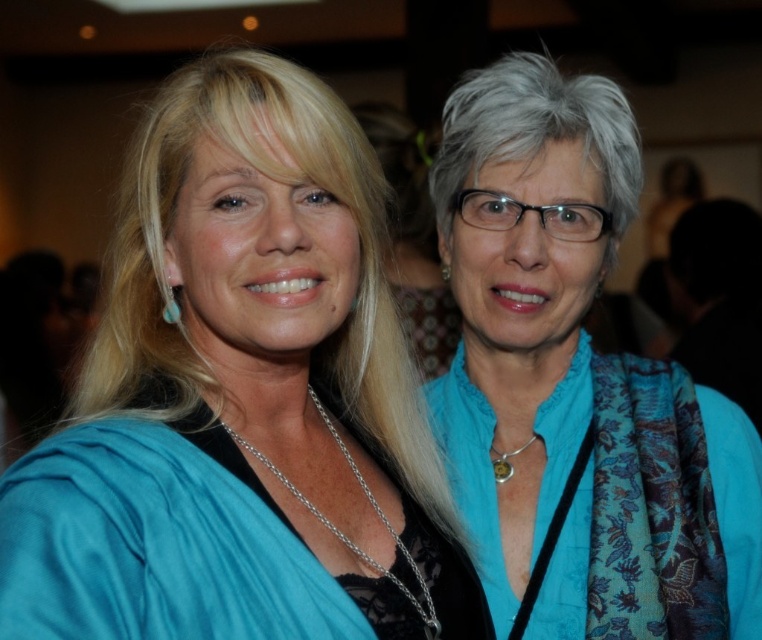
You are organizing a fashion show and need to decide which item to display first. The blue silk blouse at center and the blue silk scarf at upper right are both available. Based on their sizes, which item should be displayed first if you want to start with the smaller one?

The blue silk blouse at center is shorter than the blue silk scarf at upper right, so the blue silk blouse at center should be displayed first as it is smaller.

You are standing in the room and want to take a photo of the point at coordinates point (724, 627). The camera you are using has a minimum focus distance of 1.2 meters. Will the camera be able to focus on the point?

The point (724, 627) is 1.19 meters away from the camera, which is within the minimum focus distance of 1.2 meters. Therefore, the camera should be able to focus on the point.

You are an interior designer analyzing the image. The blue silk blouse at center is part of a color scheme you need to assess. Based on its position at point 0.625, 0.319, is it closer to the left edge or the right edge of the image?

The blue silk blouse at center is located at point (242, 400). Since the x coordinate is 0.625, which is closer to 1.0 than 0.0, it is closer to the right edge of the image.